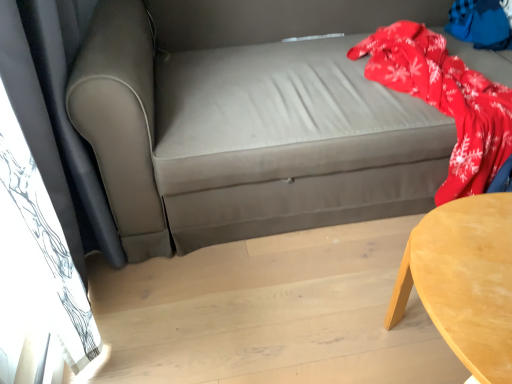
Question: Considering the relative sizes of red fleece blanket at upper right and matte gray couch at center in the image provided, is red fleece blanket at upper right bigger than matte gray couch at center?

Choices:
 (A) no
 (B) yes

Answer: (A)

Question: Is red fleece blanket at upper right looking in the opposite direction of matte gray couch at center?

Choices:
 (A) yes
 (B) no

Answer: (A)

Question: Is red fleece blanket at upper right located outside matte gray couch at center?

Choices:
 (A) no
 (B) yes

Answer: (A)

Question: Are red fleece blanket at upper right and matte gray couch at center beside each other?

Choices:
 (A) no
 (B) yes

Answer: (A)

Question: From the image's perspective, is red fleece blanket at upper right below matte gray couch at center?

Choices:
 (A) yes
 (B) no

Answer: (B)

Question: Visually, is red fleece blanket at upper right positioned to the left or to the right of matte gray couch at center?

Choices:
 (A) right
 (B) left

Answer: (A)

Question: Considering the positions of red fleece blanket at upper right and matte gray couch at center in the image, is red fleece blanket at upper right wider or thinner than matte gray couch at center?

Choices:
 (A) wide
 (B) thin

Answer: (B)

Question: Considering their positions, is red fleece blanket at upper right located in front of or behind matte gray couch at center?

Choices:
 (A) front
 (B) behind

Answer: (B)

Question: From the image's perspective, relative to matte gray couch at center, is red fleece blanket at upper right above or below?

Choices:
 (A) below
 (B) above

Answer: (B)

Question: Do you think light wood table at lower right is within red fleece blanket at upper right, or outside of it?

Choices:
 (A) inside
 (B) outside

Answer: (B)

Question: Would you say light wood table at lower right is to the left or to the right of red fleece blanket at upper right in the picture?

Choices:
 (A) left
 (B) right

Answer: (A)

Question: Is light wood table at lower right wider or thinner than red fleece blanket at upper right?

Choices:
 (A) wide
 (B) thin

Answer: (A)

Question: In terms of size, does light wood table at lower right appear bigger or smaller than red fleece blanket at upper right?

Choices:
 (A) big
 (B) small

Answer: (A)

Question: Is red fleece blanket at upper right bigger or smaller than red fleece blanket at upper right?

Choices:
 (A) big
 (B) small

Answer: (A)

Question: Visually, is red fleece blanket at upper right positioned to the left or to the right of red fleece blanket at upper right?

Choices:
 (A) left
 (B) right

Answer: (A)